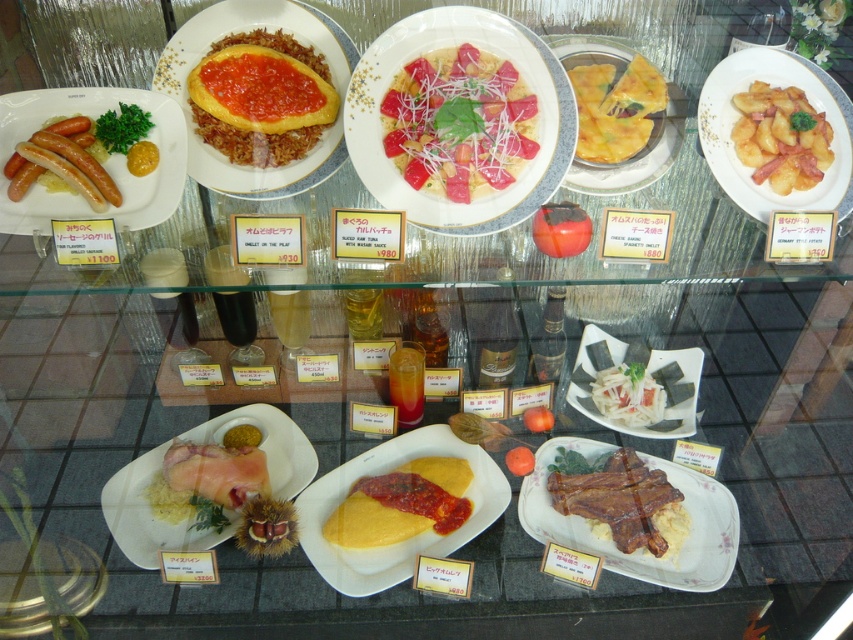
Question: Is yellow matte omelette at center thinner than grilled meat at center?

Choices:
 (A) no
 (B) yes

Answer: (A)

Question: Can you confirm if matte yellow omelette at center is wider than matte white plate with sausages at left?

Choices:
 (A) no
 (B) yes

Answer: (A)

Question: Which point is farther to the camera?

Choices:
 (A) smooth white plate at center
 (B) yellow matte polenta at center

Answer: (B)

Question: Considering the real-world distances, which object is closest to the yellow polenta at center?

Choices:
 (A) yellow crispy pastry at center
 (B) matte white plate with sausages at left

Answer: (A)

Question: Estimate the real-world distances between objects in this image. Which object is closer to the yellow matte omelette at center?

Choices:
 (A) brown fuzzy chestnut at center
 (B) matte white plate with sausages at left
 (C) white matte seaweed salad at center

Answer: (A)

Question: Where is matte white plate with sausages at left located in relation to yellow crispy pastry at center in the image?

Choices:
 (A) below
 (B) above

Answer: (A)